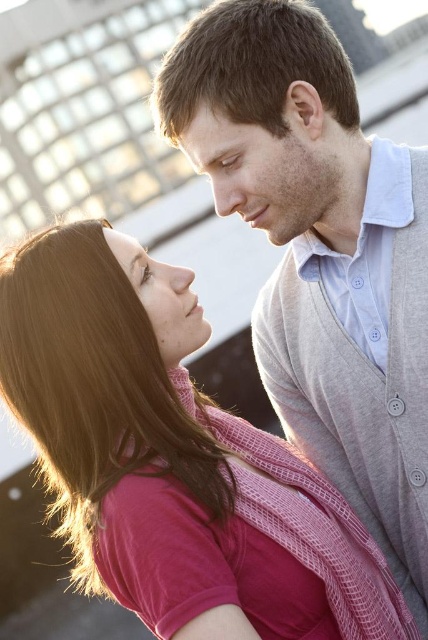
You are standing at the point labeled point [344,513] and want to move towards the point labeled point [220,193]. Based on their positions, will you be moving forward or backward relative to your current facing direction?

Since point [344,513] is in front of point [220,193], moving towards point [220,193] would mean moving backward relative to your current facing direction.

You are standing in front of the scene and want to determine which of the two points, point (264, 620) or point (211, 161), is nearer to you. Based on the spatial arrangement, which point is closer?

Point (264, 620) is closer to the viewer than point (211, 161).

You are a photographer standing 3 meters away from the light gray knit sweater at upper right. Can you estimate whether the matte skin forehead at upper center is within your camera frame if your camera has a 1.5 meter focal length?

The light gray knit sweater at upper right and matte skin forehead at upper center are 4.43 meters apart. Since you are 3 meters away from the sweater, the total distance from you to the forehead would be 3 meters plus 4.43 meters, totaling 7.43 meters. With a 1.5 meter focal length, the camera can only focus up to 1.5 meters, so the matte skin forehead at upper center would be out of frame.